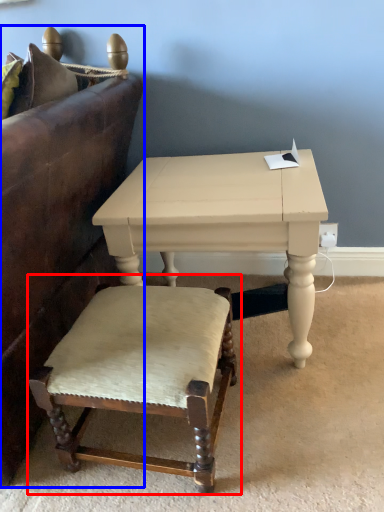
Question: Among these objects, which one is farthest to the camera, chair (highlighted by a red box) or studio couch (highlighted by a blue box)?

Choices:
 (A) chair
 (B) studio couch

Answer: (A)